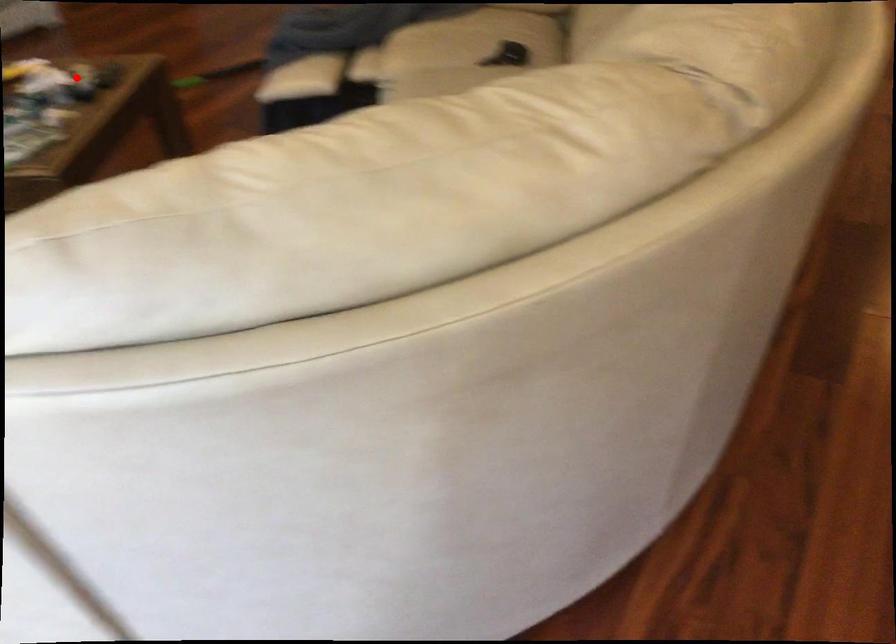
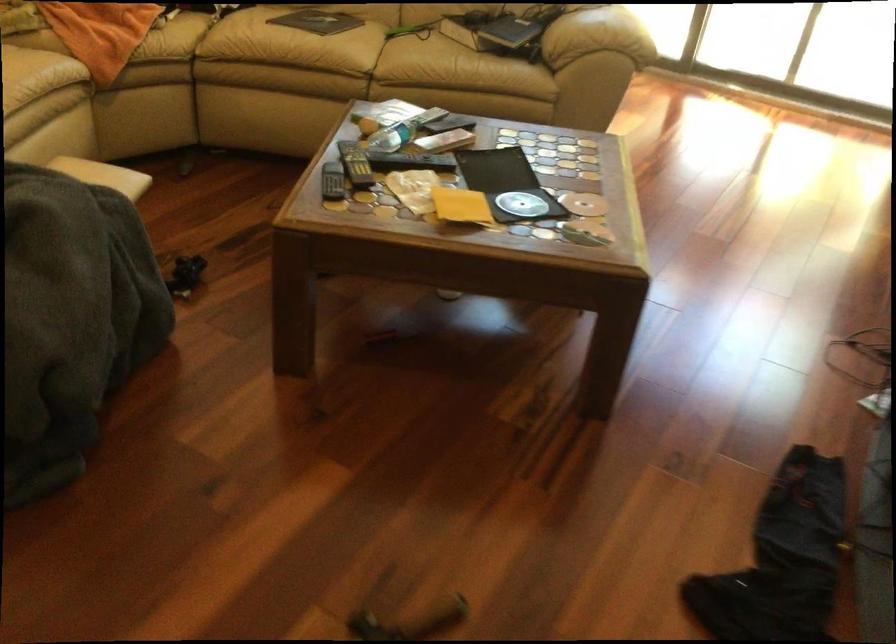
Locate, in the second image, the point that corresponds to the highlighted location in the first image.

(355, 164)